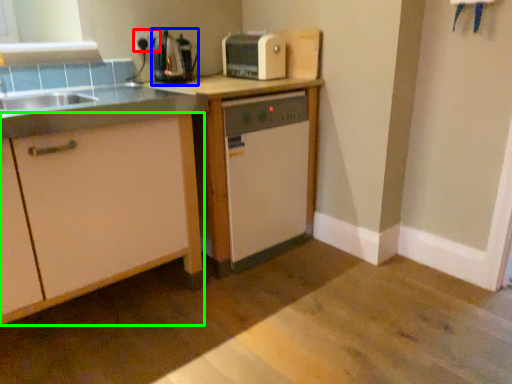
Question: Which object is the closest to the electric outlet (highlighted by a red box)? Choose among these: coffee machine (highlighted by a blue box) or cabinetry (highlighted by a green box).

Choices:
 (A) coffee machine
 (B) cabinetry

Answer: (A)